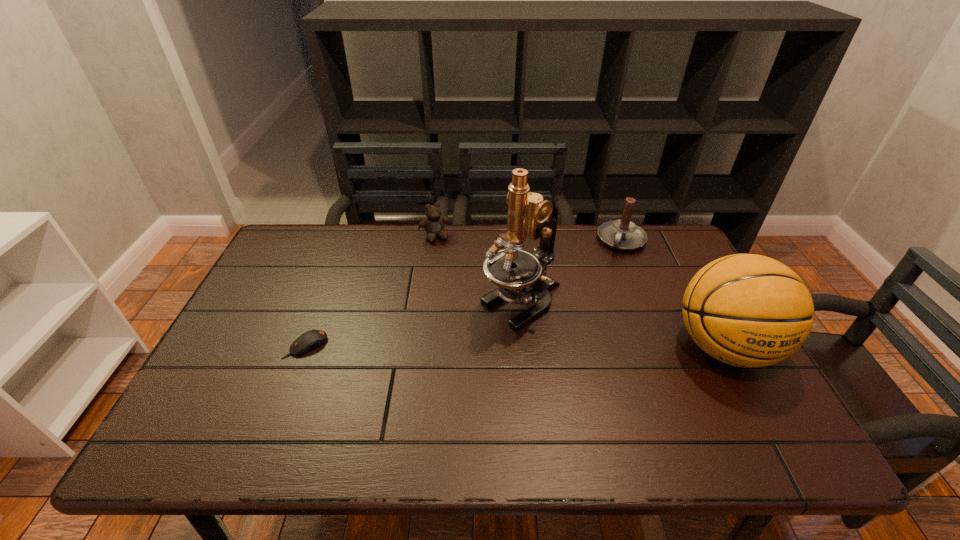
Image resolution: width=960 pixels, height=540 pixels. I want to click on vacant area that lies between the basketball and the teddy bear, so click(580, 292).

Identify the location of free space between the second shortest object and the second tallest object. (580, 292).

Identify the location of unoccupied area between the third shortest object and the leftmost object. (464, 293).

You are a GUI agent. You are given a task and a screenshot of the screen. Output one action in this format:
    pyautogui.click(x=<x>, y=<y>)
    Task: Click on the unoccupied position between the shortest object and the basketball
    This screenshot has width=960, height=540.
    Given the screenshot: What is the action you would take?
    pyautogui.click(x=516, y=346)

Identify the location of vacant area that lies between the computer mouse and the second tallest object. (516, 346).

Identify the location of free space that is in between the third object from right to left and the shortest object. pos(414,325).

Image resolution: width=960 pixels, height=540 pixels. Identify the location of free space between the second shortest object and the shortest object. (371, 291).

Where is `free space between the fourth shortest object and the fourth tallest object`? free space between the fourth shortest object and the fourth tallest object is located at coordinates (580, 292).

Image resolution: width=960 pixels, height=540 pixels. What are the coordinates of `empty space that is in between the microscope and the fourth tallest object` in the screenshot? It's located at (x=478, y=271).

At what (x,y) coordinates should I click in order to perform the action: click on object that ranks as the closest to the second object from left to right. Please return your answer as a coordinate pair (x, y). Looking at the image, I should click on (521, 276).